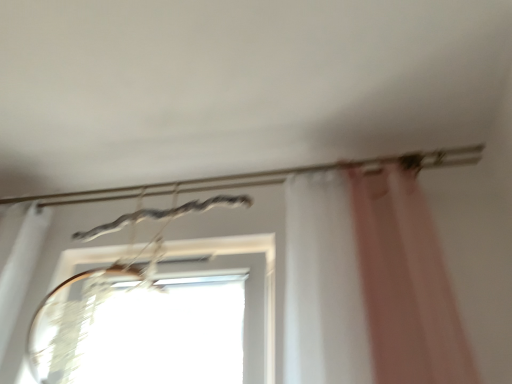
Where is `transparent glass window at center`? Image resolution: width=512 pixels, height=384 pixels. transparent glass window at center is located at coordinates (243, 303).

Describe the element at coordinates (243, 303) in the screenshot. I see `transparent glass window at center` at that location.

What do you see at coordinates (258, 177) in the screenshot? The height and width of the screenshot is (384, 512). I see `metallic wire at upper center` at bounding box center [258, 177].

Where is `metallic wire at upper center`? metallic wire at upper center is located at coordinates click(x=258, y=177).

This screenshot has width=512, height=384. What are the coordinates of `transparent glass window at center` in the screenshot? It's located at (243, 303).

Which is more to the left, metallic wire at upper center or transparent glass window at center?

transparent glass window at center is more to the left.

Is the position of metallic wire at upper center less distant than that of transparent glass window at center?

No, metallic wire at upper center is further to the viewer.

Does point (193, 183) come behind point (268, 337)?

Yes, point (193, 183) is farther from viewer.

From the image's perspective, is metallic wire at upper center located above transparent glass window at center?

Yes, from the image's perspective, metallic wire at upper center is on top of transparent glass window at center.

From a real-world perspective, relative to transparent glass window at center, is metallic wire at upper center vertically above or below?

Clearly, from a real-world perspective, metallic wire at upper center is above transparent glass window at center.

Is metallic wire at upper center thinner than transparent glass window at center?

Yes, metallic wire at upper center is thinner than transparent glass window at center.

Considering the relative sizes of metallic wire at upper center and transparent glass window at center in the image provided, is metallic wire at upper center taller than transparent glass window at center?

No.

In the scene shown: Which of these two, metallic wire at upper center or transparent glass window at center, is smaller?

metallic wire at upper center.

Is metallic wire at upper center spatially inside transparent glass window at center, or outside of it?

metallic wire at upper center is spatially situated outside transparent glass window at center.

Is metallic wire at upper center in contact with transparent glass window at center?

metallic wire at upper center and transparent glass window at center are not in contact.

Is metallic wire at upper center positioned with its back to transparent glass window at center?

No.

How many degrees apart are the facing directions of metallic wire at upper center and transparent glass window at center?

The angular difference between metallic wire at upper center and transparent glass window at center is 0.0649 degrees.

At what (x,y) coordinates should I click in order to perform the action: click on clothesline lying on the right of transparent glass window at center. Please return your answer as a coordinate pair (x, y). Looking at the image, I should click on (258, 177).

Based on their positions, is transparent glass window at center located to the left or right of metallic wire at upper center?

From the image, it's evident that transparent glass window at center is to the left of metallic wire at upper center.

Is transparent glass window at center further to camera compared to metallic wire at upper center?

No, it is not.

Considering the positions of points (141, 356) and (202, 186), is point (141, 356) closer to camera compared to point (202, 186)?

Yes, it is in front of point (202, 186).

From the image's perspective, between transparent glass window at center and metallic wire at upper center, which one is located above?

metallic wire at upper center is shown above in the image.

From a real-world perspective, relative to metallic wire at upper center, is transparent glass window at center vertically above or below?

transparent glass window at center is situated lower than metallic wire at upper center in the real world.

Between transparent glass window at center and metallic wire at upper center, which one has larger width?

transparent glass window at center is wider.

Does transparent glass window at center have a lesser height compared to metallic wire at upper center?

No.

Which of these two, transparent glass window at center or metallic wire at upper center, is bigger?

Bigger between the two is transparent glass window at center.

Would you say transparent glass window at center is outside metallic wire at upper center?

Absolutely, transparent glass window at center is external to metallic wire at upper center.

Is transparent glass window at center beside metallic wire at upper center?

transparent glass window at center is not next to metallic wire at upper center, and they're not touching.

Could you tell me if transparent glass window at center is turned towards metallic wire at upper center?

No, transparent glass window at center is not turned towards metallic wire at upper center.

Identify the location of window that appears below the metallic wire at upper center (from a real-world perspective). pyautogui.click(x=243, y=303).

This screenshot has height=384, width=512. Identify the location of window in front of the metallic wire at upper center. (243, 303).

Find the location of a particular element. Image resolution: width=512 pixels, height=384 pixels. window located underneath the metallic wire at upper center (from a real-world perspective) is located at coordinates (243, 303).